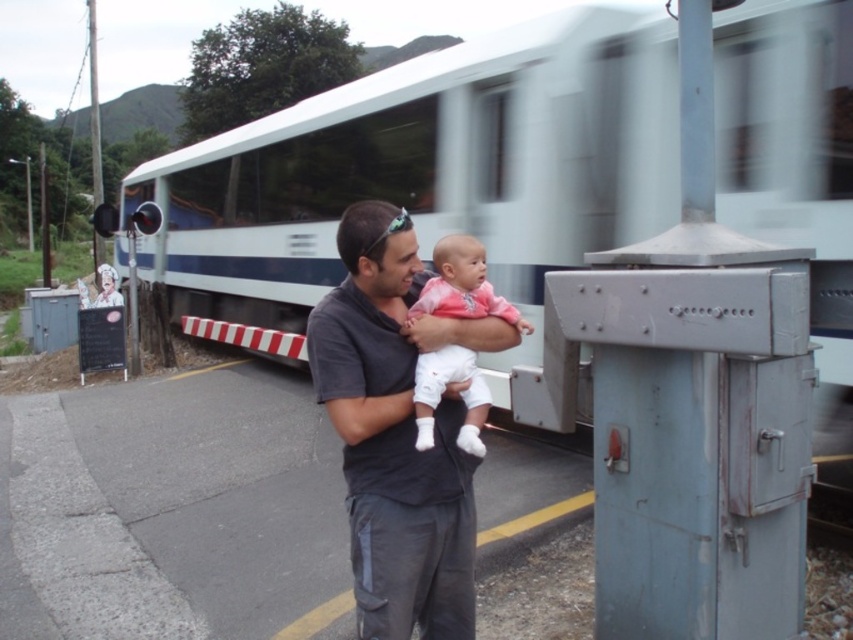
You are a photographer trying to capture a photo of the dark gray shirt at center and the pink fabric baby at center. If you want to ensure both subjects are fully visible in the frame, which subject should you adjust your focus to prioritize based on their sizes?

The dark gray shirt at center is wider than the pink fabric baby at center. To ensure both are fully visible, prioritize focusing on the dark gray shirt at center since it requires more space in the frame.

You are a photographer standing at the railway crossing. You want to take a photo of the dark gray shirt at center and the white glossy train at center. Which object should you focus on first to ensure both are in sharp focus?

The white glossy train at center is closer to the viewer than the dark gray shirt at center, so you should focus on the white glossy train at center first to ensure both are in sharp focus.